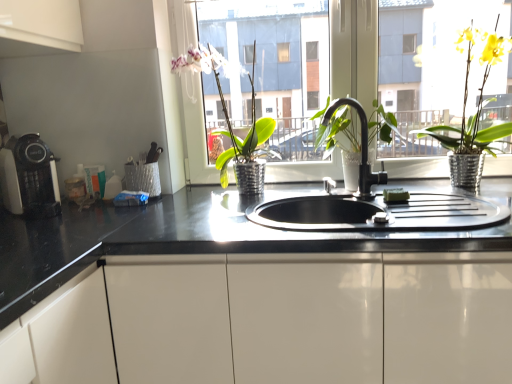
What do you see at coordinates (353, 50) in the screenshot? This screenshot has height=384, width=512. I see `transparent glass window at center` at bounding box center [353, 50].

Describe the element at coordinates (29, 177) in the screenshot. The width and height of the screenshot is (512, 384). I see `matte black coffee machine at left` at that location.

Image resolution: width=512 pixels, height=384 pixels. I want to click on green metallic pot at center, the 1th houseplant from the left, so click(245, 150).

Looking at their sizes, would you say matte black coffee machine at left is wider or thinner than green metallic pot at center, the 1th houseplant from the left?

Considering their sizes, matte black coffee machine at left looks broader than green metallic pot at center, the 1th houseplant from the left.

Would you say matte black coffee machine at left is inside or outside green metallic pot at center, the 1th houseplant from the left?

matte black coffee machine at left is not enclosed by green metallic pot at center, the 1th houseplant from the left.

Does matte black coffee machine at left turn towards green metallic pot at center, the 1th houseplant from the left?

No, matte black coffee machine at left is not turned towards green metallic pot at center, the 1th houseplant from the left.

From the picture: How different are the orientations of matte black coffee machine at left and yellow metallic pot at upper right, which is the 2th houseplant from left to right, in degrees?

They differ by 45.3 degrees in their facing directions.

Can you confirm if matte black coffee machine at left is shorter than yellow metallic pot at upper right, which is the 2th houseplant from left to right?

Indeed, matte black coffee machine at left has a lesser height compared to yellow metallic pot at upper right, which is the 2th houseplant from left to right.

Consider the image. From a real-world perspective, between matte black coffee machine at left and yellow metallic pot at upper right, placed as the first houseplant when sorted from right to left, who is vertically higher?

yellow metallic pot at upper right, placed as the first houseplant when sorted from right to left, from a real-world perspective.

Is yellow metallic pot at upper right, which is the 2th houseplant from left to right, at the back of matte black coffee machine at left?

No, matte black coffee machine at left's orientation is not away from yellow metallic pot at upper right, which is the 2th houseplant from left to right.

Can you tell me how much transparent glass window at center and black glossy countertop at center differ in facing direction?

0.0844 degrees separate the facing orientations of transparent glass window at center and black glossy countertop at center.

Who is taller, transparent glass window at center or black glossy countertop at center?

Answer: With more height is black glossy countertop at center.

Can you confirm if transparent glass window at center is bigger than black glossy countertop at center?

Incorrect, transparent glass window at center is not larger than black glossy countertop at center.

From a real-world perspective, is transparent glass window at center located higher than matte black coffee machine at left?

Yes, from a real-world perspective, transparent glass window at center is on top of matte black coffee machine at left.

Is transparent glass window at center in front of or behind matte black coffee machine at left in the image?

Clearly, transparent glass window at center is behind matte black coffee machine at left.

Does transparent glass window at center have a greater height compared to matte black coffee machine at left?

Indeed, transparent glass window at center has a greater height compared to matte black coffee machine at left.

From the picture: Which object is positioned more to the left, transparent glass window at center or black matte faucet at center?

From the viewer's perspective, black matte faucet at center appears more on the left side.

Which object is thinner, transparent glass window at center or black matte faucet at center?

With smaller width is transparent glass window at center.

Does transparent glass window at center turn towards black matte faucet at center?

Yes, transparent glass window at center is turned towards black matte faucet at center.

Can you see transparent glass window at center touching black matte faucet at center?

No, transparent glass window at center is not beside black matte faucet at center.

Between yellow metallic pot at upper right, which is the 2th houseplant from left to right, and green metallic pot at center, which is counted as the second houseplant, starting from the right, which one has smaller size?

With smaller size is green metallic pot at center, which is counted as the second houseplant, starting from the right.

Is yellow metallic pot at upper right, which is the 2th houseplant from left to right, oriented towards green metallic pot at center, which is counted as the second houseplant, starting from the right?

No, yellow metallic pot at upper right, which is the 2th houseplant from left to right, is not facing towards green metallic pot at center, which is counted as the second houseplant, starting from the right.

Measure the distance between yellow metallic pot at upper right, placed as the first houseplant when sorted from right to left, and green metallic pot at center, the 1th houseplant from the left.

28.63 inches.

At what (x,y) coordinates should I click in order to perform the action: click on houseplant on the right of green metallic pot at center, which is counted as the second houseplant, starting from the right. Please return your answer as a coordinate pair (x, y). The height and width of the screenshot is (384, 512). Looking at the image, I should click on (475, 113).

Would you say green metallic pot at center, the 1th houseplant from the left, contains matte black coffee machine at left?

No, matte black coffee machine at left is not surrounded by green metallic pot at center, the 1th houseplant from the left.

Which is behind, point (209, 64) or point (29, 214)?

The point (209, 64) is farther from the camera.

From a real-world perspective, who is located higher, green metallic pot at center, the 1th houseplant from the left, or matte black coffee machine at left?

From a 3D spatial view, green metallic pot at center, the 1th houseplant from the left, is above.

From the image's perspective, is green metallic pot at center, which is counted as the second houseplant, starting from the right, located beneath matte black coffee machine at left?

Incorrect, from the image's perspective, green metallic pot at center, which is counted as the second houseplant, starting from the right, is higher than matte black coffee machine at left.

Find the location of a particular element. This screenshot has width=512, height=384. houseplant that is the 2nd object located behind the matte black coffee machine at left is located at coordinates point(245,150).

Where is `coffee machine in front of the yellow metallic pot at upper right, which is the 2th houseplant from left to right`? coffee machine in front of the yellow metallic pot at upper right, which is the 2th houseplant from left to right is located at coordinates (29, 177).

Estimate the real-world distances between objects in this image. Which object is closer to black glossy countertop at center, matte black coffee machine at left or black matte faucet at center?

matte black coffee machine at left is closer to black glossy countertop at center.

Which object lies further to the anchor point yellow metallic pot at upper right, which is the 2th houseplant from left to right, green metallic pot at center, the 1th houseplant from the left, or black glossy countertop at center?

black glossy countertop at center is further to yellow metallic pot at upper right, which is the 2th houseplant from left to right.

Estimate the real-world distances between objects in this image. Which object is further from black glossy countertop at center, green metallic pot at center, which is counted as the second houseplant, starting from the right, or matte black coffee machine at left?

Among the two, green metallic pot at center, which is counted as the second houseplant, starting from the right, is located further to black glossy countertop at center.

When comparing their distances from black matte faucet at center, does green metallic pot at center, which is counted as the second houseplant, starting from the right, or black glossy countertop at center seem further?

black glossy countertop at center is positioned further to the anchor black matte faucet at center.

Based on the photo, based on their spatial positions, is yellow metallic pot at upper right, which is the 2th houseplant from left to right, or green metallic pot at center, the 1th houseplant from the left, further from transparent glass window at center?

Based on the image, yellow metallic pot at upper right, which is the 2th houseplant from left to right, appears to be further to transparent glass window at center.

When comparing their distances from green metallic pot at center, the 1th houseplant from the left, does black glossy countertop at center or yellow metallic pot at upper right, which is the 2th houseplant from left to right, seem closer?

black glossy countertop at center is positioned closer to the anchor green metallic pot at center, the 1th houseplant from the left.

Which object lies further to the anchor point transparent glass window at center, black matte faucet at center or green metallic pot at center, the 1th houseplant from the left?

The object further to transparent glass window at center is black matte faucet at center.

Which object lies further to the anchor point matte black coffee machine at left, yellow metallic pot at upper right, placed as the first houseplant when sorted from right to left, or black matte faucet at center?

Among the two, yellow metallic pot at upper right, placed as the first houseplant when sorted from right to left, is located further to matte black coffee machine at left.

Identify the location of tap between matte black coffee machine at left and yellow metallic pot at upper right, which is the 2th houseplant from left to right, in the horizontal direction. [361, 146].

You are a GUI agent. You are given a task and a screenshot of the screen. Output one action in this format:
    pyautogui.click(x=<x>, y=<y>)
    Task: Click on the window between green metallic pot at center, the 1th houseplant from the left, and yellow metallic pot at upper right, placed as the first houseplant when sorted from right to left, from left to right
    
    Given the screenshot: What is the action you would take?
    pyautogui.click(x=353, y=50)

Image resolution: width=512 pixels, height=384 pixels. In order to click on tap situated between green metallic pot at center, which is counted as the second houseplant, starting from the right, and transparent glass window at center from left to right in this screenshot , I will do `click(361, 146)`.

This screenshot has width=512, height=384. Identify the location of window between black matte faucet at center and yellow metallic pot at upper right, which is the 2th houseplant from left to right, from left to right. (353, 50).